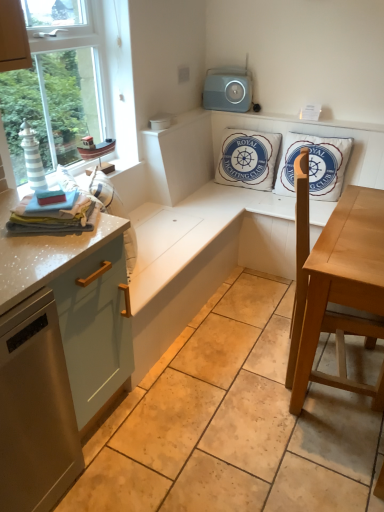
Question: Is gray plastic speaker at upper center to the right of light brown wooden table at center from the viewer's perspective?

Choices:
 (A) yes
 (B) no

Answer: (B)

Question: Is gray plastic speaker at upper center not inside light brown wooden table at center?

Choices:
 (A) yes
 (B) no

Answer: (A)

Question: Does gray plastic speaker at upper center come in front of light brown wooden table at center?

Choices:
 (A) yes
 (B) no

Answer: (B)

Question: Does gray plastic speaker at upper center have a greater width compared to light brown wooden table at center?

Choices:
 (A) yes
 (B) no

Answer: (B)

Question: Is light brown wooden table at center completely or partially inside gray plastic speaker at upper center?

Choices:
 (A) yes
 (B) no

Answer: (B)

Question: From a real-world perspective, is gray plastic speaker at upper center located higher than light brown wooden table at center?

Choices:
 (A) no
 (B) yes

Answer: (B)

Question: From the image's perspective, is white cotton cushion at upper center, which is the 1th pillow in left-to-right order, located beneath white cotton cushion at upper right, which is counted as the 2th pillow, starting from the left?

Choices:
 (A) no
 (B) yes

Answer: (A)

Question: Is white cotton cushion at upper center, which is counted as the second pillow, starting from the right, positioned with its back to white cotton cushion at upper right, which is counted as the 2th pillow, starting from the left?

Choices:
 (A) yes
 (B) no

Answer: (B)

Question: Could white cotton cushion at upper right, marked as the 1th pillow in a right-to-left arrangement, be considered to be inside white cotton cushion at upper center, which is counted as the second pillow, starting from the right?

Choices:
 (A) yes
 (B) no

Answer: (B)

Question: Can we say white cotton cushion at upper center, which is counted as the second pillow, starting from the right, lies outside white cotton cushion at upper right, marked as the 1th pillow in a right-to-left arrangement?

Choices:
 (A) yes
 (B) no

Answer: (A)

Question: Is white cotton cushion at upper center, which is counted as the second pillow, starting from the right, bigger than white cotton cushion at upper right, marked as the 1th pillow in a right-to-left arrangement?

Choices:
 (A) yes
 (B) no

Answer: (B)

Question: Is white cotton cushion at upper center, which is the 1th pillow in left-to-right order, to the right of white cotton cushion at upper right, marked as the 1th pillow in a right-to-left arrangement, from the viewer's perspective?

Choices:
 (A) no
 (B) yes

Answer: (A)

Question: Does white cotton cushion at upper center, which is the 1th pillow in left-to-right order, have a lesser width compared to gray plastic speaker at upper center?

Choices:
 (A) no
 (B) yes

Answer: (A)